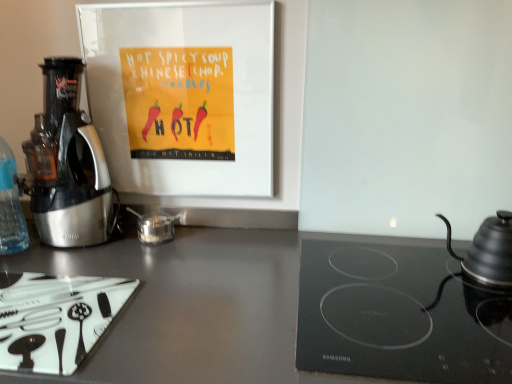
Image resolution: width=512 pixels, height=384 pixels. I want to click on free space above white glossy cutting board at lower left, marked as the first kitchen appliance in a left-to-right arrangement (from a real-world perspective), so click(x=42, y=299).